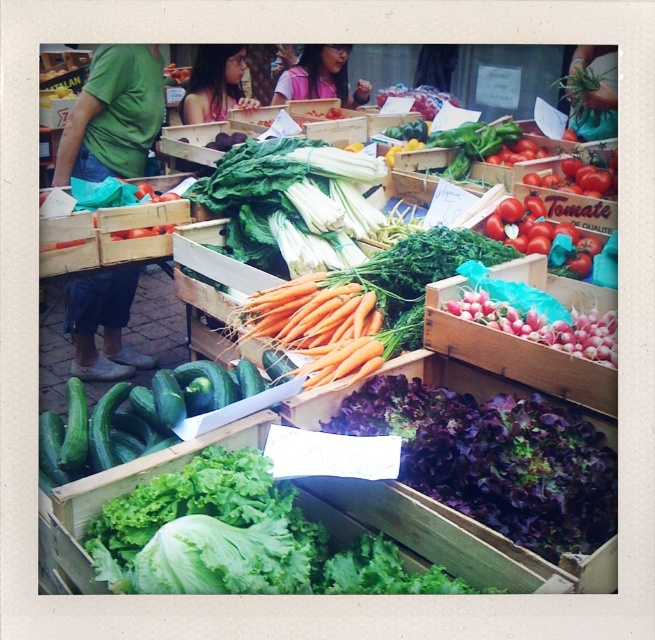
Image resolution: width=655 pixels, height=640 pixels. What are the coordinates of `purple leafy lettuce at center` in the screenshot? It's located at (495, 460).

Who is positioned more to the left, purple leafy lettuce at center or red matte tomatoes at upper right?

Positioned to the left is purple leafy lettuce at center.

Identify the location of purple leafy lettuce at center. Image resolution: width=655 pixels, height=640 pixels. (495, 460).

Is point (157, 525) farther from viewer compared to point (512, 292)?

No, (157, 525) is closer to viewer.

Between green leafy lettuce at center and pink radish at right, which one has less height?

pink radish at right is shorter.

Is point (337, 564) positioned in front of point (555, 344)?

Yes, it is in front of point (555, 344).

Locate an element on the screen. Image resolution: width=655 pixels, height=640 pixels. green leafy lettuce at center is located at coordinates (244, 540).

Who is taller, orange matte carrots at center or pink radish at right?

orange matte carrots at center is taller.

From the picture: Between orange matte carrots at center and pink radish at right, which one appears on the left side from the viewer's perspective?

orange matte carrots at center is more to the left.

Which is behind, point (405, 310) or point (464, 301)?

The point (405, 310) is more distant.

The height and width of the screenshot is (640, 655). I want to click on orange matte carrots at center, so click(329, 326).